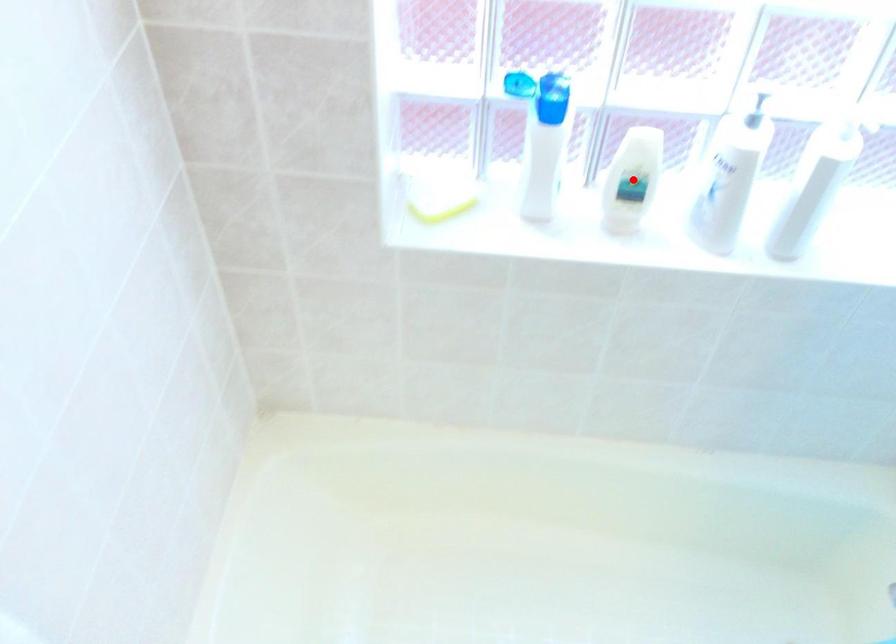
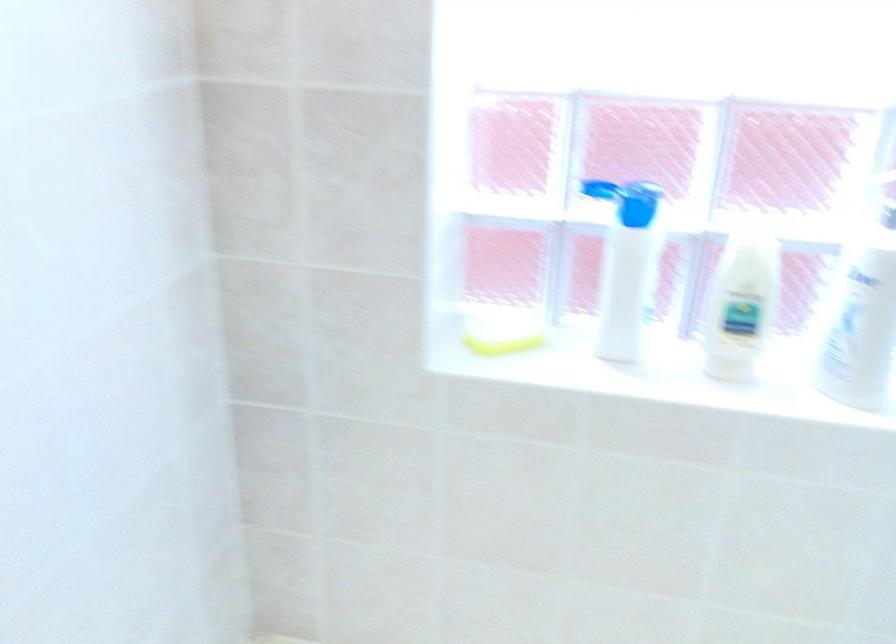
Where in the second image is the point corresponding to the highlighted location from the first image?

(741, 305)